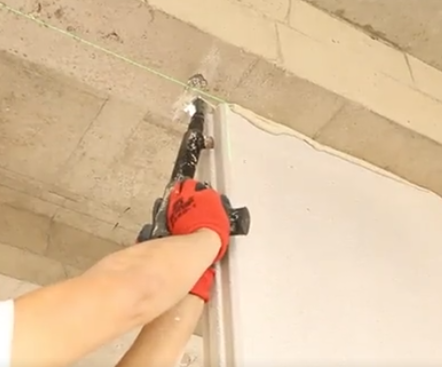
In order to click on beige concrete ceiling in this screenshot , I will do `click(180, 21)`.